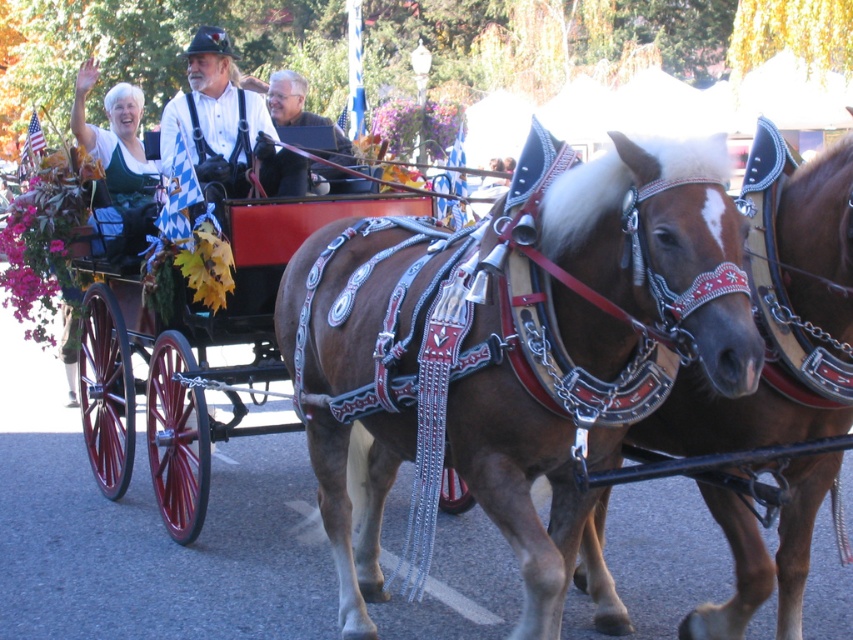
You are standing at the starting point of the parade route. You see two points marked in the image. The first point is at coordinate point(408, 323) and the second point is at coordinate point(751, 531). If you want to walk towards the second point, which direction should you move relative to the first point?

To move from point(408, 323) to point(751, 531), you should move towards the northeast direction since the second point is northeast of the first point.

You are a photographer trying to capture both the brown glossy horse at center and the brown shiny horse at center in a single shot. Since you want to emphasize the larger horse, which horse should you focus on to ensure it appears bigger in the photo?

The brown glossy horse at center is larger in size than the brown shiny horse at center, so focusing on the brown glossy horse at center will ensure it appears bigger in the photo.

You are a photographer positioned at the back of the carriage. You want to take a photo that includes both the brown shiny horse at center and the matte brown leather jacket at center. Which object should you focus on first to ensure both are in the frame?

The brown shiny horse at center is larger in size than the matte brown leather jacket at center, so you should focus on the brown shiny horse at center first to ensure both are in the frame.